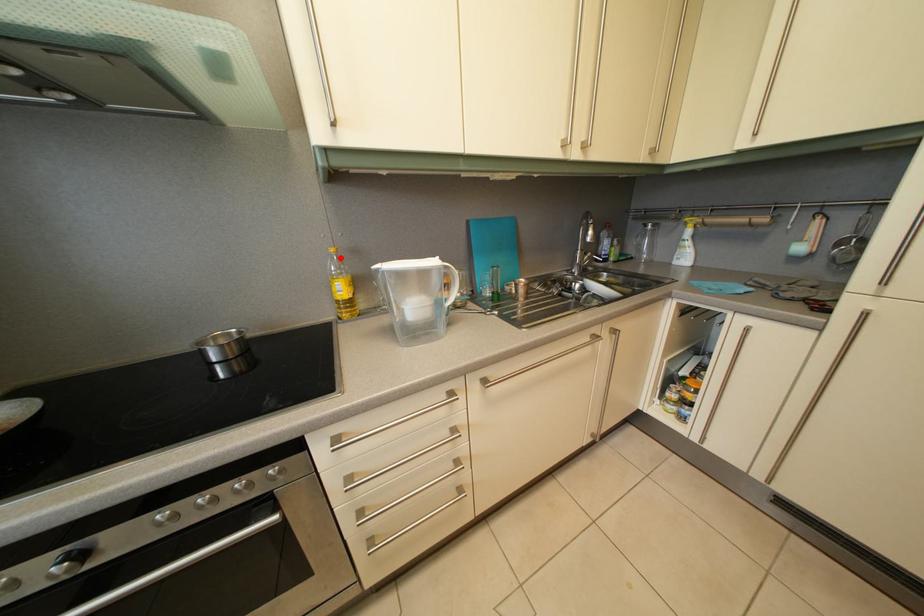
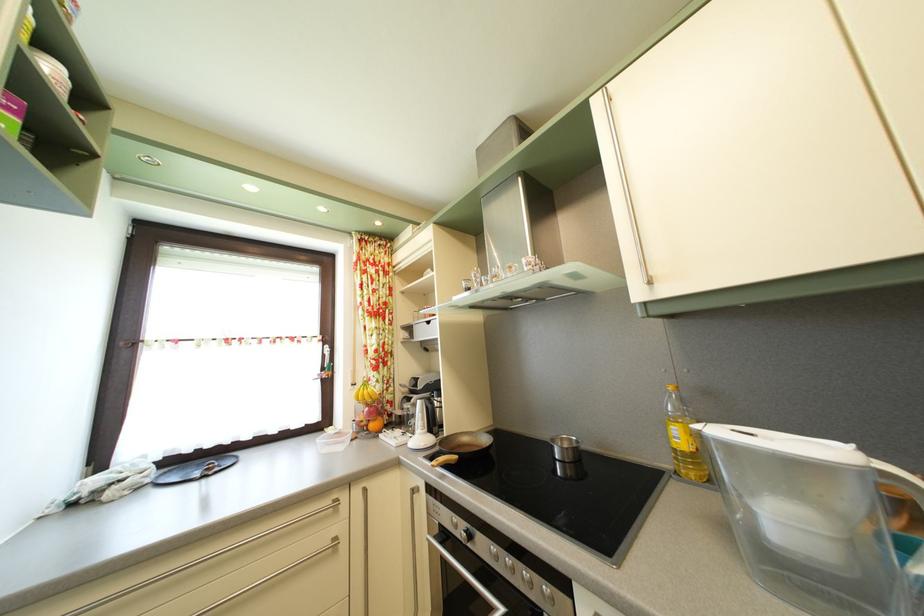
Question: I am providing you with two images of the same scene from different viewpoints. A red point is marked on the first image. Can you still see the location of the red point in image 2?

Choices:
 (A) Yes
 (B) No

Answer: (A)